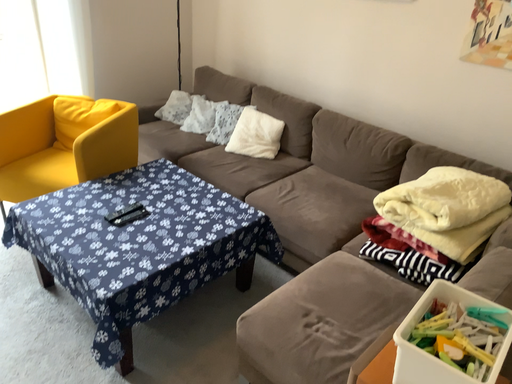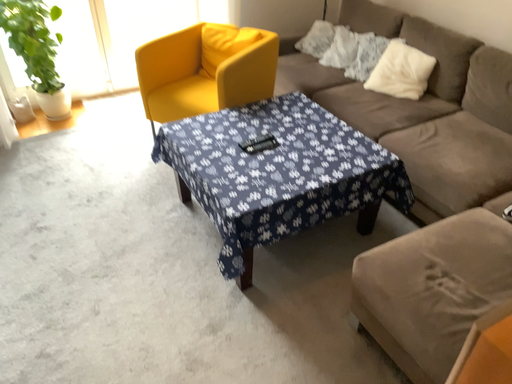
Question: How did the camera likely rotate when shooting the video?

Choices:
 (A) rotated right
 (B) rotated left

Answer: (B)